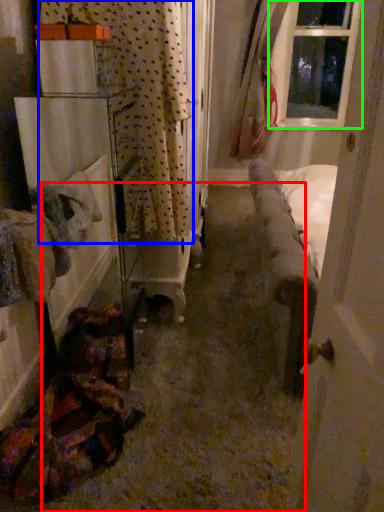
Question: Which object is positioned farthest from path (highlighted by a red box)? Select from curtain (highlighted by a blue box) and window (highlighted by a green box).

Choices:
 (A) curtain
 (B) window

Answer: (B)